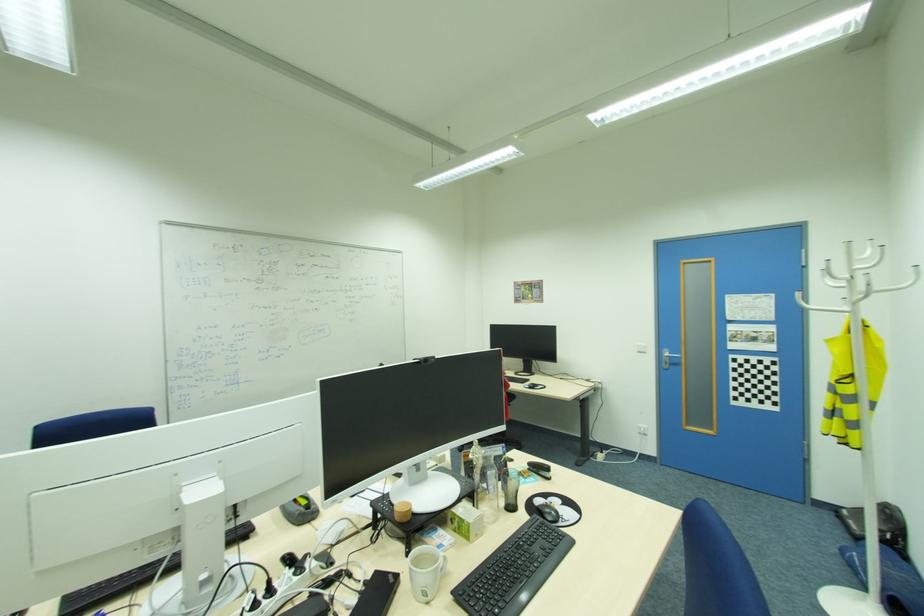
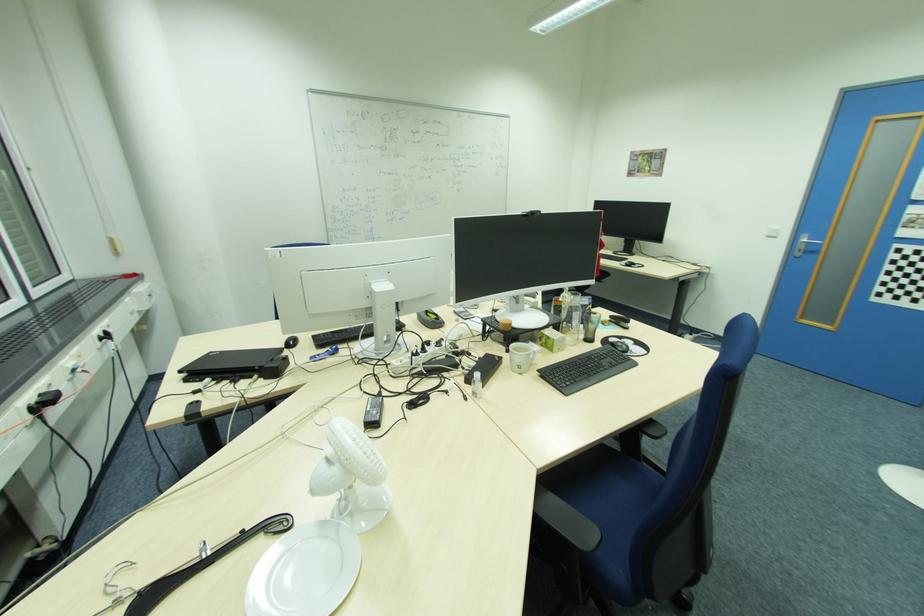
The point at (493, 496) is marked in the first image. Where is the corresponding point in the second image?

(576, 331)